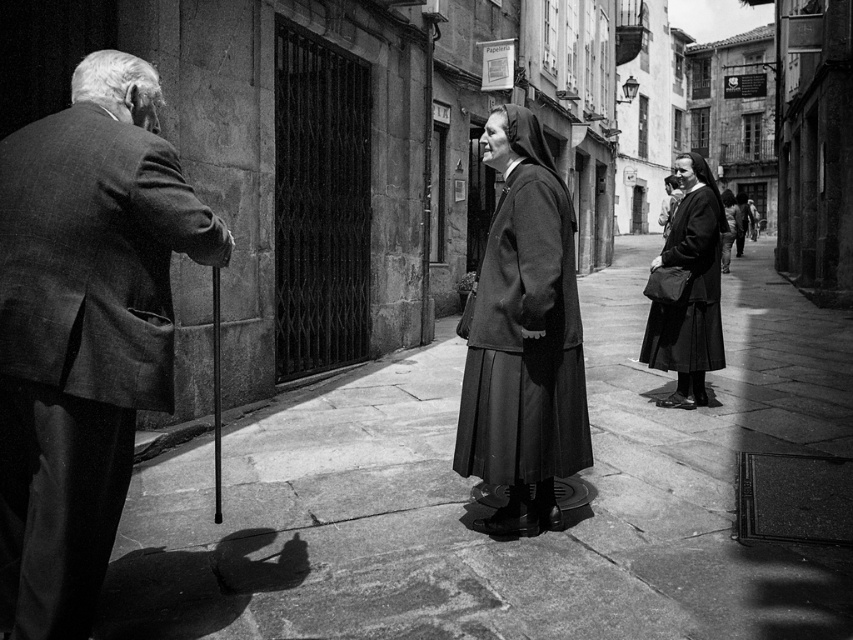
Does point (26, 154) lie in front of point (698, 355)?

Yes, it is in front of point (698, 355).

Between point (84, 604) and point (697, 234), which one is positioned in front?

Point (84, 604) is in front.

Identify the location of textured wool suit at left. (84, 330).

At what (x,y) coordinates should I click in order to perform the action: click on textured wool suit at left. Please return your answer as a coordinate pair (x, y). Looking at the image, I should click on point(84,330).

Can you confirm if smooth stone pavement at center is shorter than textured wool suit at left?

Yes.

Which is in front, point (640, 564) or point (22, 209)?

Point (22, 209)

In order to click on smooth stone pavement at center in this screenshot , I will do 488,509.

Is smooth stone pavement at center below matte black dress at center?

Indeed, smooth stone pavement at center is positioned under matte black dress at center.

In the scene shown: Can you confirm if smooth stone pavement at center is shorter than matte black dress at center?

Yes, smooth stone pavement at center is shorter than matte black dress at center.

Who is more forward, (250,433) or (693,276)?

Point (250,433) is in front.

Identify the location of smooth stone pavement at center. The height and width of the screenshot is (640, 853). (488, 509).